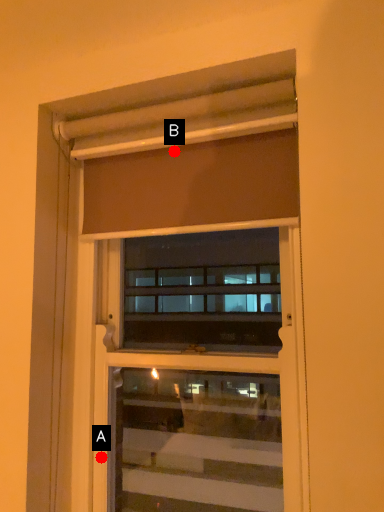
Question: Two points are circled on the image, labeled by A and B beside each circle. Which point is further to the camera?

Choices:
 (A) A is further
 (B) B is further

Answer: (A)